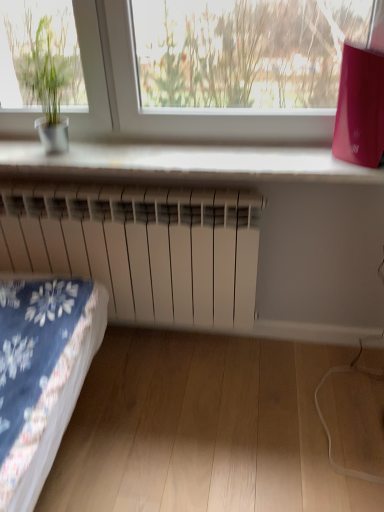
Where is `vacant area that lies to the right of green matte plant pot at left`? Image resolution: width=384 pixels, height=512 pixels. vacant area that lies to the right of green matte plant pot at left is located at coordinates (112, 151).